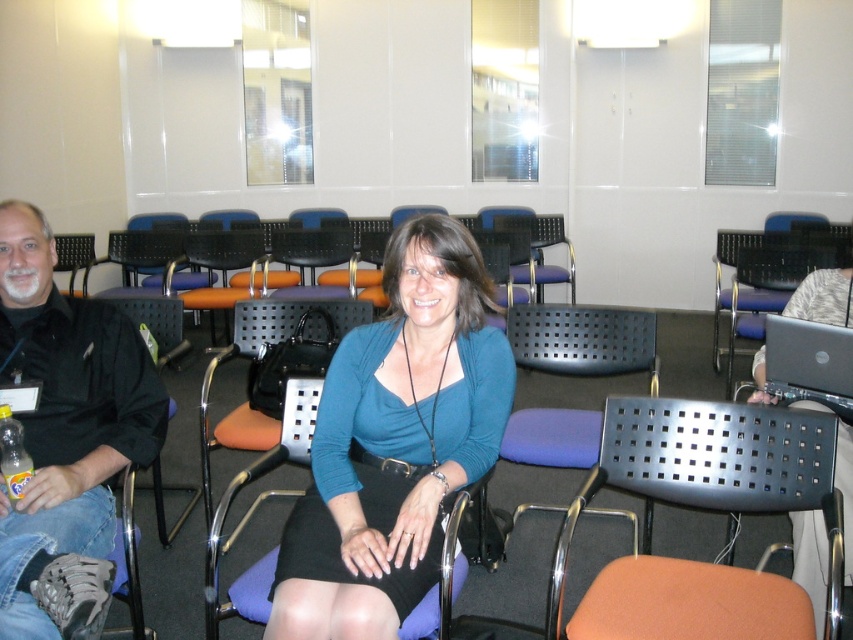
Question: Considering the relative positions of orange fabric chair at right and black plastic laptop at upper right in the image provided, where is orange fabric chair at right located with respect to black plastic laptop at upper right?

Choices:
 (A) below
 (B) above

Answer: (A)

Question: Is orange fabric chair at right closer to the viewer compared to black plastic laptop at upper right?

Choices:
 (A) no
 (B) yes

Answer: (B)

Question: Among these points, which one is nearest to the camera?

Choices:
 (A) (782, 266)
 (B) (753, 333)

Answer: (B)

Question: Which of the following is the closest to the observer?

Choices:
 (A) (456, 276)
 (B) (718, 250)
 (C) (780, 376)
 (D) (792, 257)

Answer: (A)

Question: Among these objects, which one is farthest from the camera?

Choices:
 (A) black perforated chair at center
 (B) black matte shirt at left
 (C) black plastic laptop at upper right
 (D) purple fabric chair at center

Answer: (C)

Question: Is teal matte shirt at center positioned at the back of black matte shirt at left?

Choices:
 (A) no
 (B) yes

Answer: (A)